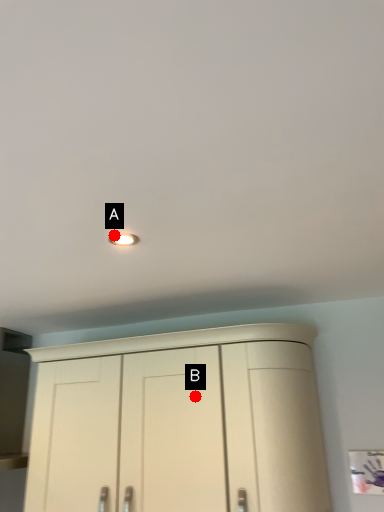
Question: Two points are circled on the image, labeled by A and B beside each circle. Which point is closer to the camera?

Choices:
 (A) A is closer
 (B) B is closer

Answer: (A)